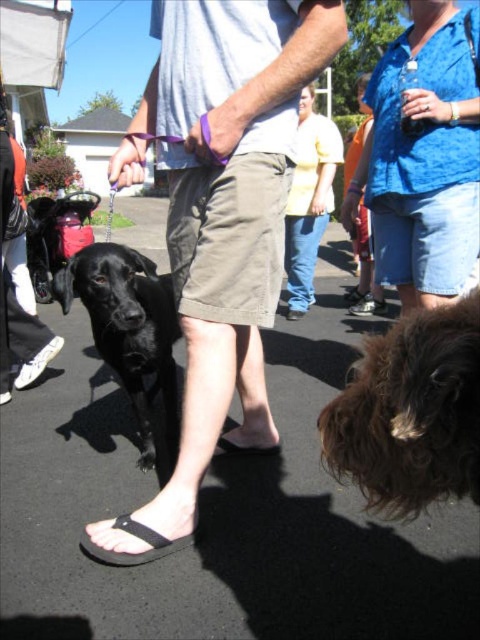
You are a photographer trying to capture a clear photo of the shiny black dog at lower left and the black rubber sandal at lower center. Which object will appear bigger in your photo?

The shiny black dog at lower left will appear bigger in the photo because it is larger in size than the black rubber sandal at lower center.

You are standing at the origin point of the image coordinate system. Which object is located at the coordinates point [309,200]?

The point [309,200] corresponds to the yellow cotton shirt at center.

You are standing at the center of the image and want to pick up the black rubber sandal at lower center. Which direction should you move to reach it while avoiding the shiny black dog at lower left?

Since the shiny black dog at lower left is to the left of the black rubber sandal at lower center, you should move to the right to reach the sandal while avoiding the dog.